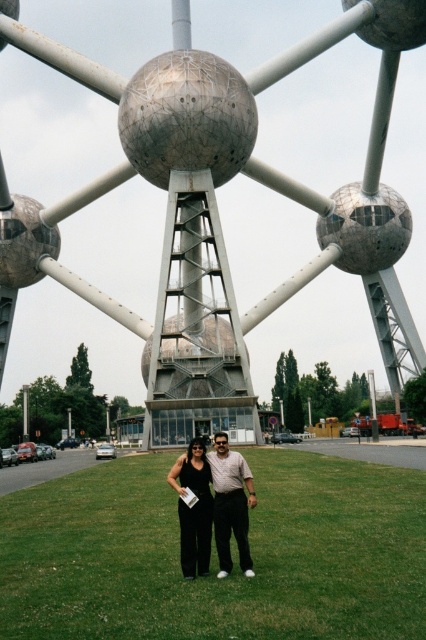
Between green grass at center and black fabric couple at center, which one has more height?

Standing taller between the two is black fabric couple at center.

Does green grass at center have a larger size compared to black fabric couple at center?

Indeed, green grass at center has a larger size compared to black fabric couple at center.

This screenshot has width=426, height=640. What do you see at coordinates (215, 556) in the screenshot?
I see `green grass at center` at bounding box center [215, 556].

Locate an element on the screen. The image size is (426, 640). green grass at center is located at coordinates (215, 556).

Does green grass at center have a greater height compared to black satin dress at center?

No.

Which is behind, point (394, 637) or point (184, 536)?

Positioned behind is point (184, 536).

Find the location of a particular element. Image resolution: width=426 pixels, height=640 pixels. green grass at center is located at coordinates (215, 556).

Which is behind, point (247, 499) or point (204, 460)?

Positioned behind is point (204, 460).

Can you confirm if black fabric couple at center is shorter than black satin dress at center?

No.

This screenshot has height=640, width=426. What are the coordinates of `black fabric couple at center` in the screenshot? It's located at (219, 497).